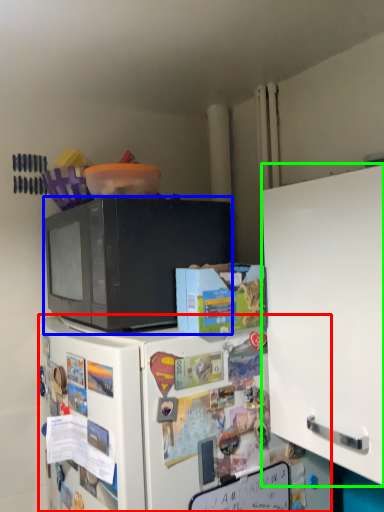
Question: Which object is positioned farthest from refrigerator (highlighted by a red box)? Select from microwave oven (highlighted by a blue box) and cabinetry (highlighted by a green box).

Choices:
 (A) microwave oven
 (B) cabinetry

Answer: (B)